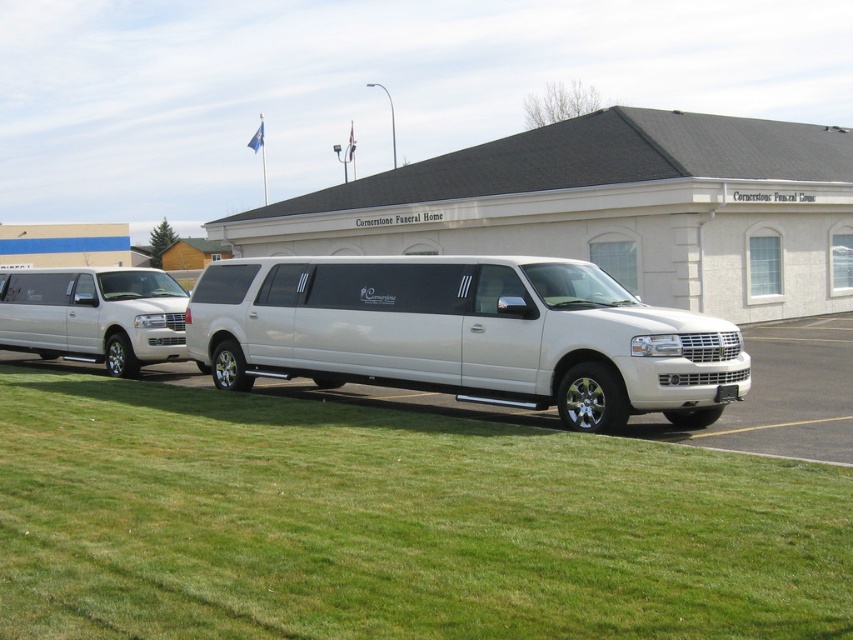
Question: Among these objects, which one is farthest from the camera?

Choices:
 (A) green grass at lower center
 (B) matte silver minivan at left

Answer: (B)

Question: Does green grass at lower center appear on the right side of white metallic van at center?

Choices:
 (A) yes
 (B) no

Answer: (B)

Question: Which object appears closest to the camera in this image?

Choices:
 (A) green grass at lower center
 (B) white metallic van at center
 (C) matte silver minivan at left

Answer: (A)

Question: Which object is farther from the camera taking this photo?

Choices:
 (A) green grass at lower center
 (B) matte silver minivan at left

Answer: (B)

Question: Is green grass at lower center positioned in front of white metallic van at center?

Choices:
 (A) yes
 (B) no

Answer: (A)

Question: Can you confirm if green grass at lower center is positioned to the right of white metallic van at center?

Choices:
 (A) yes
 (B) no

Answer: (B)